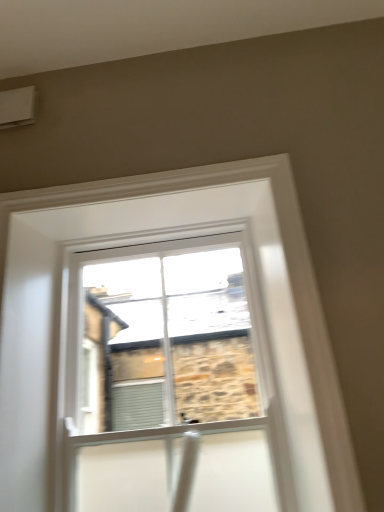
What do you see at coordinates (160, 239) in the screenshot?
I see `clear glass window at center` at bounding box center [160, 239].

At what (x,y) coordinates should I click in order to perform the action: click on clear glass window at center. Please return your answer as a coordinate pair (x, y). The image size is (384, 512). Looking at the image, I should click on (160, 239).

Where is `white plastic air conditioning unit at upper left`? white plastic air conditioning unit at upper left is located at coordinates (17, 106).

Describe the element at coordinates (17, 106) in the screenshot. The height and width of the screenshot is (512, 384). I see `white plastic air conditioning unit at upper left` at that location.

Locate an element on the screen. The width and height of the screenshot is (384, 512). clear glass window at center is located at coordinates [x=160, y=239].

Which is more to the right, clear glass window at center or white plastic air conditioning unit at upper left?

clear glass window at center.

In the scene shown: Considering the positions of objects clear glass window at center and white plastic air conditioning unit at upper left in the image provided, who is in front, clear glass window at center or white plastic air conditioning unit at upper left?

clear glass window at center is more forward.

Considering the positions of point (314, 507) and point (7, 120), is point (314, 507) closer or farther from the camera than point (7, 120)?

Point (314, 507) appears to be closer to the viewer than point (7, 120).

From the image's perspective, is clear glass window at center located above or below white plastic air conditioning unit at upper left?

Based on their image positions, clear glass window at center is located beneath white plastic air conditioning unit at upper left.

From a real-world perspective, who is located higher, clear glass window at center or white plastic air conditioning unit at upper left?

From a 3D spatial view, white plastic air conditioning unit at upper left is above.

Considering the sizes of objects clear glass window at center and white plastic air conditioning unit at upper left in the image provided, who is thinner, clear glass window at center or white plastic air conditioning unit at upper left?

clear glass window at center.

Is clear glass window at center taller or shorter than white plastic air conditioning unit at upper left?

In the image, clear glass window at center appears to be taller than white plastic air conditioning unit at upper left.

Considering the relative sizes of clear glass window at center and white plastic air conditioning unit at upper left in the image provided, is clear glass window at center bigger than white plastic air conditioning unit at upper left?

Indeed, clear glass window at center has a larger size compared to white plastic air conditioning unit at upper left.

Is clear glass window at center not inside white plastic air conditioning unit at upper left?

Absolutely, clear glass window at center is external to white plastic air conditioning unit at upper left.

Does clear glass window at center touch white plastic air conditioning unit at upper left?

clear glass window at center and white plastic air conditioning unit at upper left are not in contact.

Is clear glass window at center looking in the opposite direction of white plastic air conditioning unit at upper left?

clear glass window at center does not have its back to white plastic air conditioning unit at upper left.

What's the angular difference between clear glass window at center and white plastic air conditioning unit at upper left's facing directions?

0.54 degrees.

Find the location of `window on the right of white plastic air conditioning unit at upper left`. window on the right of white plastic air conditioning unit at upper left is located at coordinates (160, 239).

Can you confirm if white plastic air conditioning unit at upper left is positioned to the left of clear glass window at center?

Correct, you'll find white plastic air conditioning unit at upper left to the left of clear glass window at center.

Between white plastic air conditioning unit at upper left and clear glass window at center, which one is positioned behind?

white plastic air conditioning unit at upper left is further from the camera.

Between point (33, 88) and point (12, 362), which one is positioned behind?

Positioned behind is point (33, 88).

From the image's perspective, between white plastic air conditioning unit at upper left and clear glass window at center, who is located below?

clear glass window at center appears lower in the image.

From a real-world perspective, who is located lower, white plastic air conditioning unit at upper left or clear glass window at center?

clear glass window at center is physically lower.

Which object is thinner, white plastic air conditioning unit at upper left or clear glass window at center?

clear glass window at center.

Which of these two, white plastic air conditioning unit at upper left or clear glass window at center, stands shorter?

With less height is white plastic air conditioning unit at upper left.

Based on the photo, does white plastic air conditioning unit at upper left have a larger size compared to clear glass window at center?

Actually, white plastic air conditioning unit at upper left might be smaller than clear glass window at center.

Which is correct: white plastic air conditioning unit at upper left is inside clear glass window at center, or outside of it?

white plastic air conditioning unit at upper left is spatially situated outside clear glass window at center.

Are white plastic air conditioning unit at upper left and clear glass window at center making contact?

white plastic air conditioning unit at upper left and clear glass window at center are not in contact.

Is white plastic air conditioning unit at upper left facing towards clear glass window at center?

No, white plastic air conditioning unit at upper left does not turn towards clear glass window at center.

What's the angular difference between white plastic air conditioning unit at upper left and clear glass window at center's facing directions?

They differ by 0.54 degrees in their facing directions.

At what (x,y) coordinates should I click in order to perform the action: click on window located below the white plastic air conditioning unit at upper left (from the image's perspective). Please return your answer as a coordinate pair (x, y). Looking at the image, I should click on (160, 239).

At what (x,y) coordinates should I click in order to perform the action: click on air conditioning above the clear glass window at center (from a real-world perspective). Please return your answer as a coordinate pair (x, y). Looking at the image, I should click on (17, 106).

Locate an element on the screen. Image resolution: width=384 pixels, height=512 pixels. air conditioning located behind the clear glass window at center is located at coordinates (17, 106).